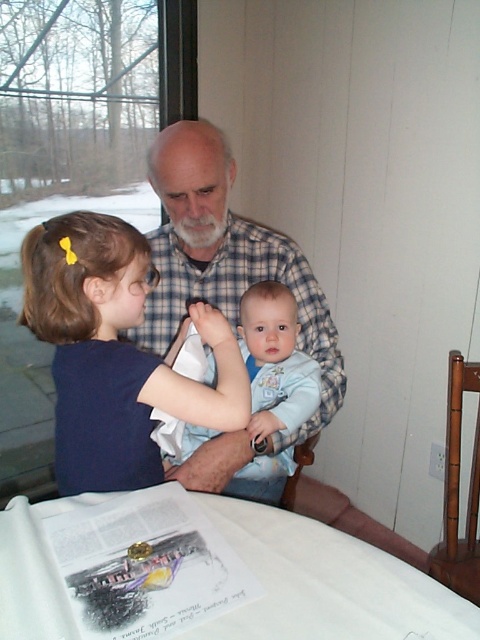
Locate an element on the screen. The image size is (480, 640). matte blue shirt at left is located at coordinates (116, 353).

Which is more to the left, matte blue shirt at left or light blue soft fabric baby at center?

matte blue shirt at left

This screenshot has height=640, width=480. Describe the element at coordinates (116, 353) in the screenshot. I see `matte blue shirt at left` at that location.

Find the location of a particular element. Image resolution: width=480 pixels, height=640 pixels. matte blue shirt at left is located at coordinates click(116, 353).

Does white paper at lower center have a greater height compared to plaid shirt at center?

No, white paper at lower center is not taller than plaid shirt at center.

Can you confirm if white paper at lower center is positioned to the right of plaid shirt at center?

Yes, white paper at lower center is to the right of plaid shirt at center.

Is point (189, 577) positioned before point (181, 161)?

Yes, it is in front of point (181, 161).

Where is `white paper at lower center`? The image size is (480, 640). white paper at lower center is located at coordinates (216, 573).

Is matte blue shirt at left taller than plaid shirt at center?

No.

Can you confirm if matte blue shirt at left is shorter than plaid shirt at center?

Yes.

Is point (127, 244) positioned before point (215, 291)?

Yes, point (127, 244) is in front of point (215, 291).

Locate an element on the screen. The height and width of the screenshot is (640, 480). matte blue shirt at left is located at coordinates (116, 353).